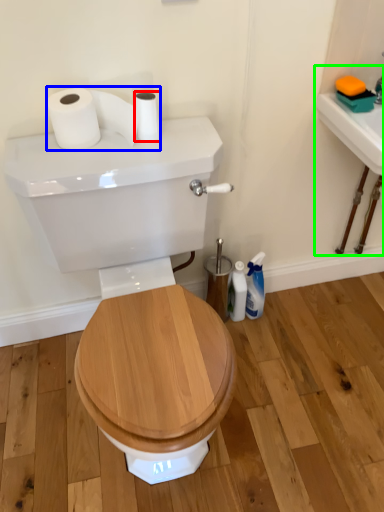
Question: Which is nearer to the toilet paper (highlighted by a red box)? toilet paper (highlighted by a blue box) or sink (highlighted by a green box).

Choices:
 (A) toilet paper
 (B) sink

Answer: (A)